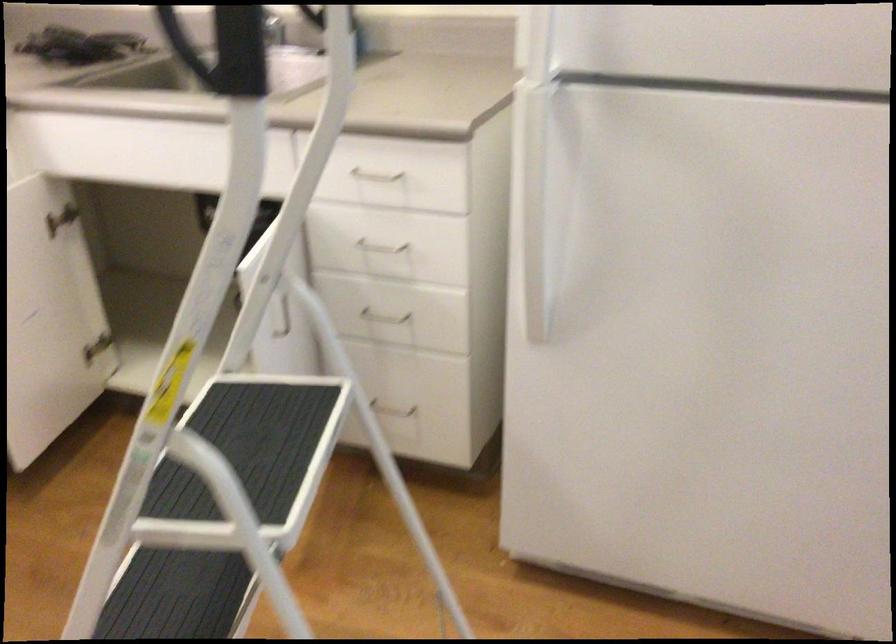
Image resolution: width=896 pixels, height=644 pixels. Identify the location of black stepladder handle. (186, 49).